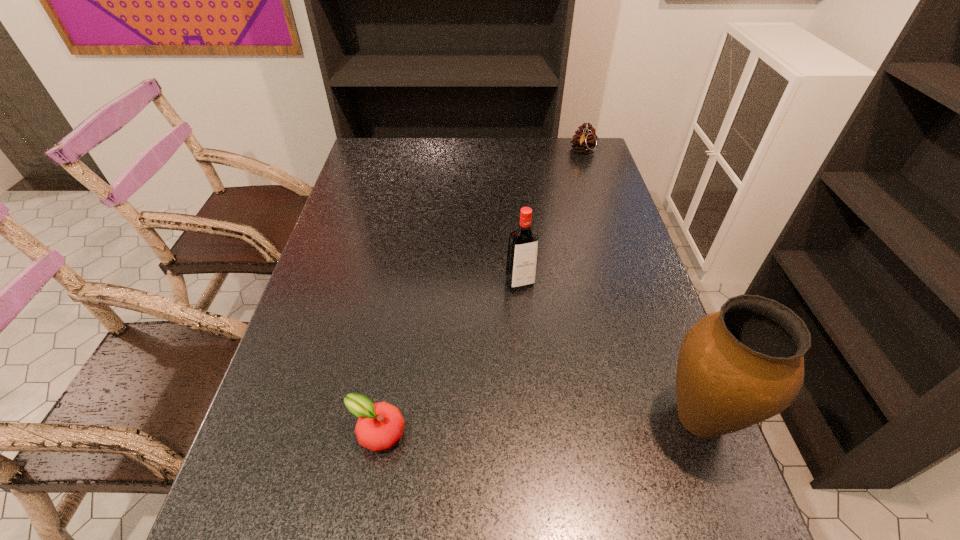
The height and width of the screenshot is (540, 960). In order to click on object at the far right corner in this screenshot , I will do `click(585, 139)`.

Identify the location of object located at the near right corner. The width and height of the screenshot is (960, 540). (744, 364).

Where is `vacant space at the far edge of the desktop`? Image resolution: width=960 pixels, height=540 pixels. vacant space at the far edge of the desktop is located at coordinates (422, 140).

Identify the location of vacant space at the near edge of the desktop. The image size is (960, 540). (530, 471).

This screenshot has width=960, height=540. I want to click on vacant space at the left edge, so click(x=386, y=175).

Where is `vacant space at the right edge`? The width and height of the screenshot is (960, 540). vacant space at the right edge is located at coordinates (604, 255).

The width and height of the screenshot is (960, 540). In the image, there is a desktop. What are the coordinates of `vacant space at the far left corner` in the screenshot? It's located at (392, 152).

This screenshot has height=540, width=960. I want to click on vacant point at the far right corner, so (558, 157).

At what (x,y) coordinates should I click in order to perform the action: click on vacant area at the near right corner of the desktop. Please return your answer as a coordinate pair (x, y). The width and height of the screenshot is (960, 540). Looking at the image, I should click on (713, 471).

What are the coordinates of `free space between the apple and the pinecone` in the screenshot? It's located at [480, 292].